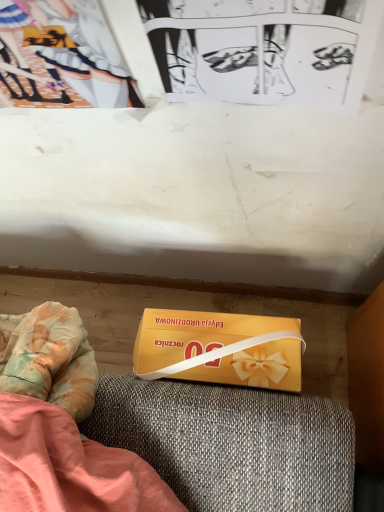
Question: Do you think black paper at upper center is within yellow matte box at lower center, or outside of it?

Choices:
 (A) inside
 (B) outside

Answer: (B)

Question: Is point (266, 93) positioned closer to the camera than point (211, 361)?

Choices:
 (A) closer
 (B) farther

Answer: (A)

Question: Estimate the real-world distances between objects in this image. Which object is farther from the black paper at upper center?

Choices:
 (A) matte paper couple at upper left
 (B) yellow matte box at lower center

Answer: (B)

Question: Considering the real-world distances, which object is closest to the matte paper couple at upper left?

Choices:
 (A) black paper at upper center
 (B) yellow matte box at lower center

Answer: (A)